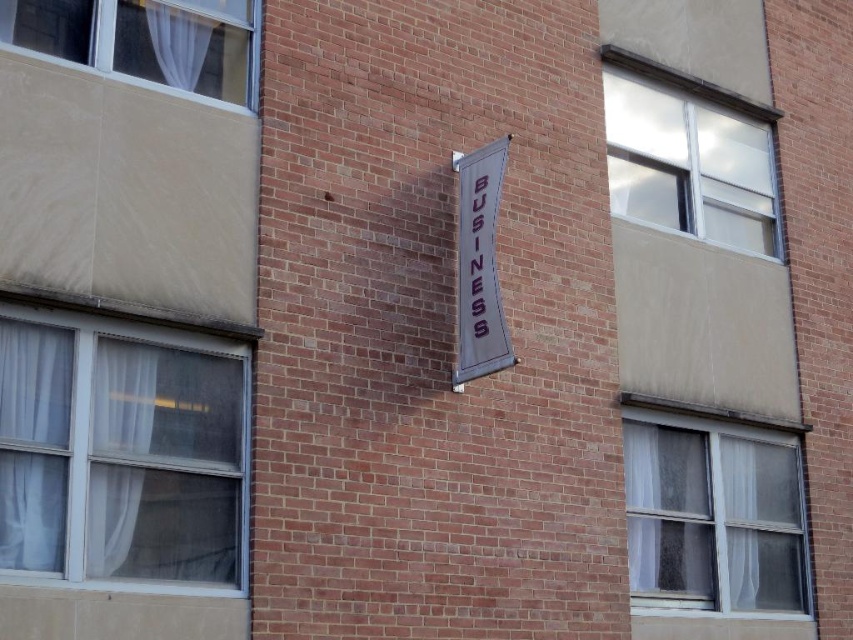
Does white sheer fabric at lower right appear under white fabric curtain at upper left?

Yes.

Who is more forward, [660,528] or [196,10]?

Point [196,10] is in front.

This screenshot has height=640, width=853. Describe the element at coordinates (712, 515) in the screenshot. I see `white sheer fabric at lower right` at that location.

The height and width of the screenshot is (640, 853). What are the coordinates of `white sheer fabric at lower right` in the screenshot? It's located at (712, 515).

Which is in front, point (706, 432) or point (465, 163)?

Point (465, 163)

Which of these two, white sheer fabric at lower right or white fabric sign at center, stands taller?

white sheer fabric at lower right is taller.

Between point (724, 518) and point (467, 348), which one is positioned in front?

Point (467, 348) is more forward.

Identify the location of white sheer fabric at lower right. This screenshot has width=853, height=640. (712, 515).

This screenshot has width=853, height=640. What are the coordinates of `clear glass window at upper right` in the screenshot? It's located at (688, 164).

Is clear glass window at upper right shorter than white fabric curtain at upper left?

In fact, clear glass window at upper right may be taller than white fabric curtain at upper left.

This screenshot has height=640, width=853. Find the location of `clear glass window at upper right`. clear glass window at upper right is located at coordinates (688, 164).